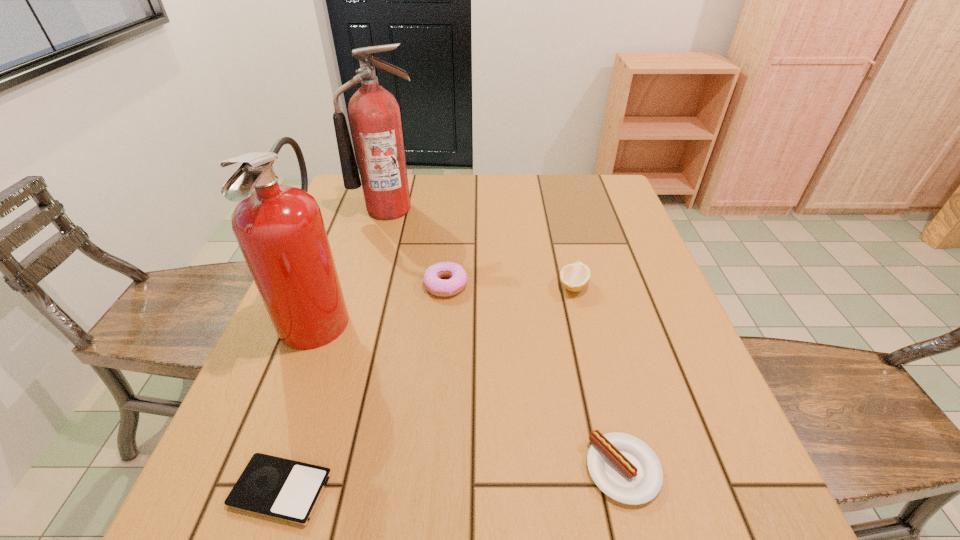
This screenshot has height=540, width=960. In the image, there is a desktop. In order to click on vacant space at the far edge in this screenshot , I will do [x=420, y=177].

Where is `vacant area at the left edge of the desktop`? This screenshot has height=540, width=960. vacant area at the left edge of the desktop is located at coordinates (349, 274).

Where is `vacant space at the right edge of the desktop`? The image size is (960, 540). vacant space at the right edge of the desktop is located at coordinates (589, 258).

Where is `free location at the far left corner of the desktop`? free location at the far left corner of the desktop is located at coordinates (347, 213).

In the image, there is a desktop. Identify the location of vacant space at the far right corner. The height and width of the screenshot is (540, 960). (576, 208).

What are the coordinates of `free spot between the doughnut and the shortest object` in the screenshot? It's located at (364, 387).

Where is `free space between the lemon and the shortest object`? free space between the lemon and the shortest object is located at coordinates (427, 388).

At what (x,y) coordinates should I click in order to perform the action: click on vacant point located between the lemon and the fifth tallest object. Please return your answer as a coordinate pair (x, y). This screenshot has height=540, width=960. Looking at the image, I should click on (598, 377).

Locate an element on the screen. The width and height of the screenshot is (960, 540). vacant point located between the lemon and the fourth object from left to right is located at coordinates (510, 285).

Locate an element on the screen. free area in between the farthest object and the nearer fire extinguisher is located at coordinates (353, 260).